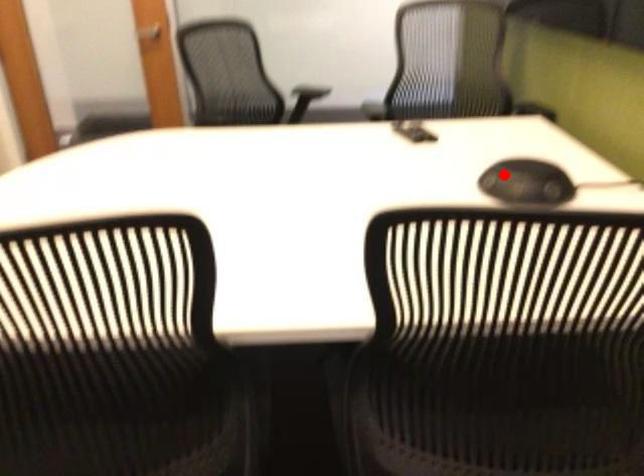
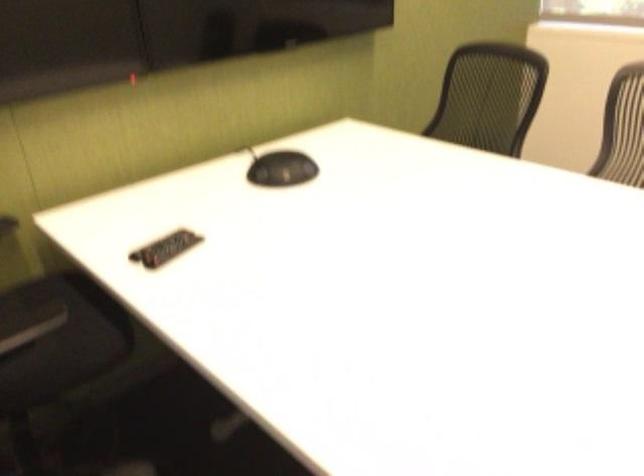
Locate, in the second image, the point that corresponds to the highlighted location in the first image.

(281, 169)